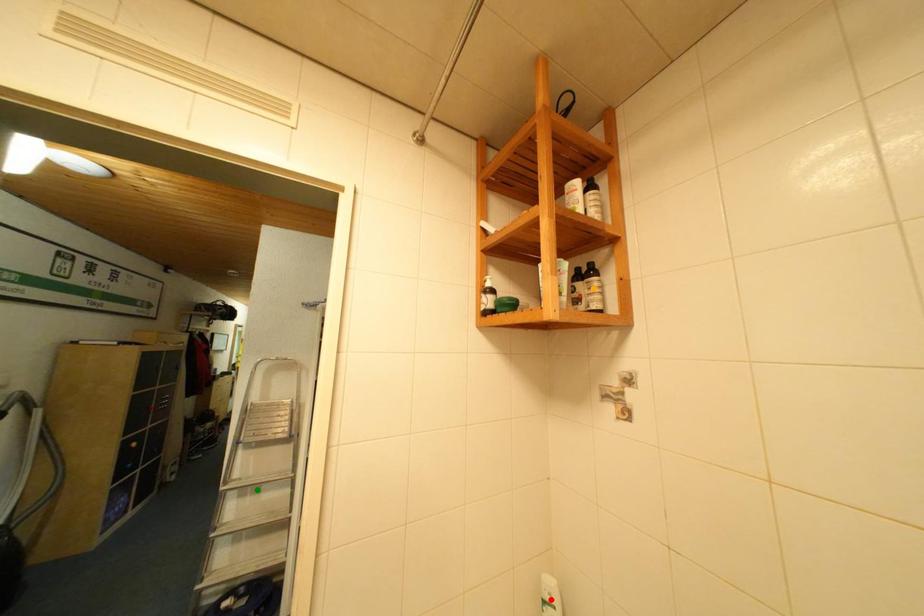
Order these from farthest to nearest:
1. red point
2. orange point
3. green point

1. green point
2. red point
3. orange point